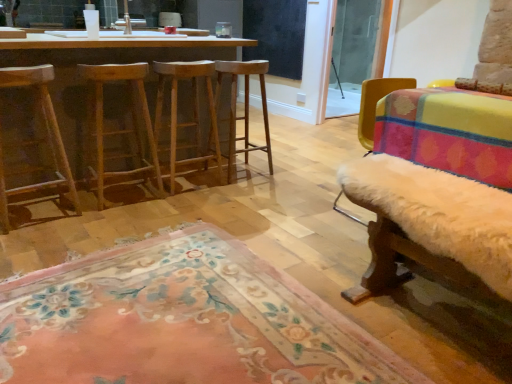
Where is `vacant space to the right of natural wood stool at center, acting as the first stool starting from the left`? vacant space to the right of natural wood stool at center, acting as the first stool starting from the left is located at coordinates (x=180, y=204).